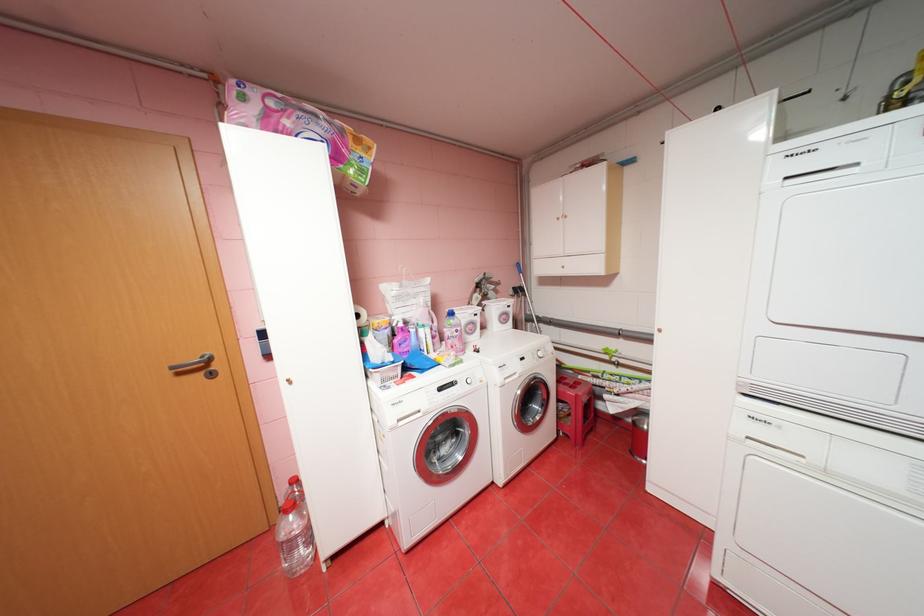
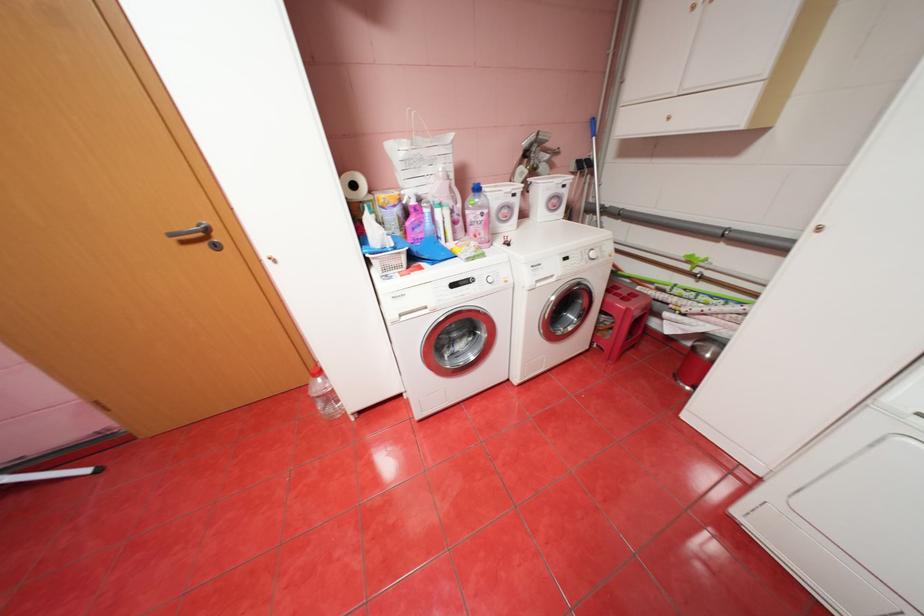
Where in the second image is the point corresponding to [548,399] from the first image?

(586, 309)